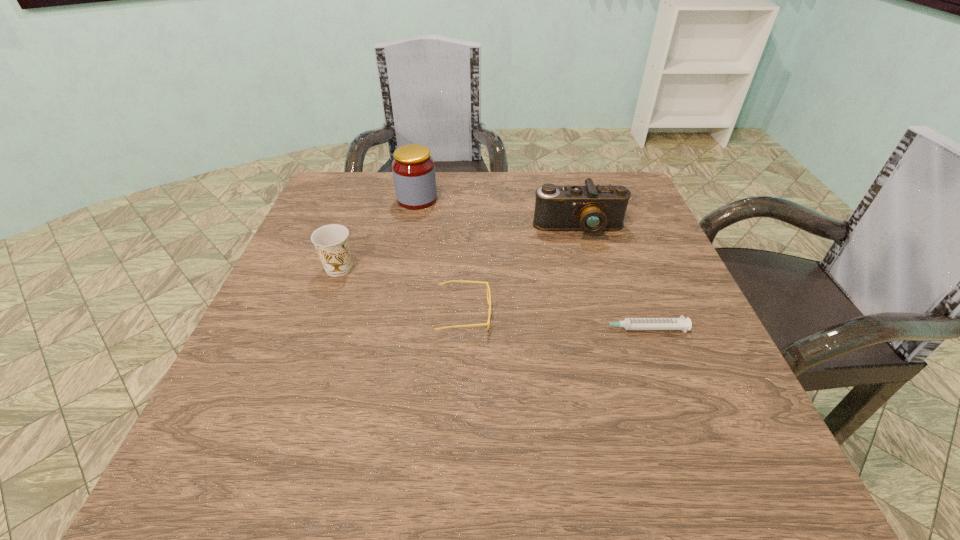
In order to click on the tallest object in this screenshot , I will do `click(413, 168)`.

Identify the location of the farthest object. This screenshot has height=540, width=960. (413, 168).

Where is `the second tallest object`? This screenshot has width=960, height=540. the second tallest object is located at coordinates (591, 209).

This screenshot has height=540, width=960. In order to click on the second farthest object in this screenshot , I will do `click(591, 209)`.

This screenshot has width=960, height=540. Identify the location of the third shortest object. (331, 241).

What are the coordinates of `the third nearest object` in the screenshot? It's located at (331, 241).

Where is `the third object from left to right`? The height and width of the screenshot is (540, 960). the third object from left to right is located at coordinates (489, 300).

Identify the location of the fourth tallest object. The image size is (960, 540). (489, 300).

I want to click on the shortest object, so click(681, 323).

Where is `vacant space located on the left of the jar`? vacant space located on the left of the jar is located at coordinates (321, 199).